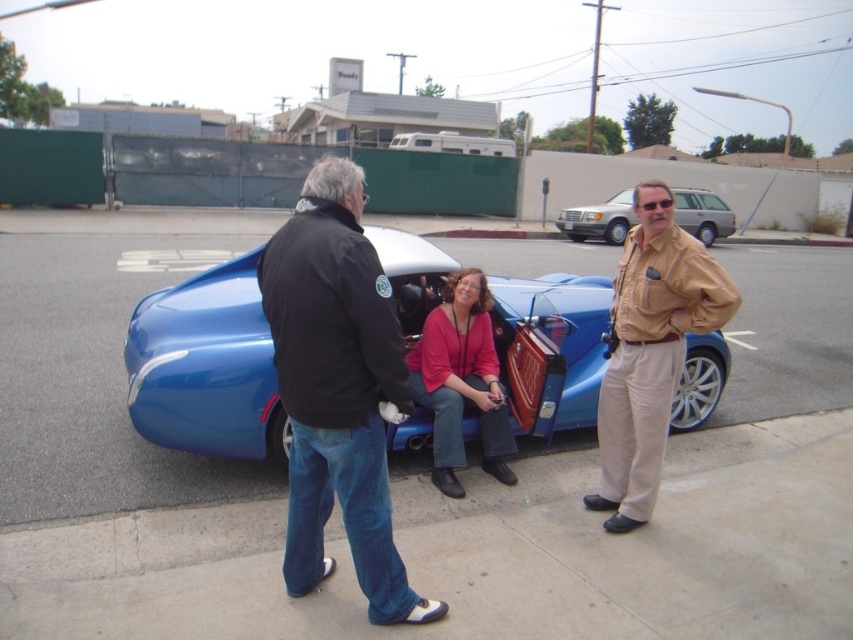
You are a photographer trying to capture a clear shot of the black leather jacket at center and the silver metallic suv at upper right. From your current position, which object will appear closer to the bottom of the photo?

The black leather jacket at center is positioned under the silver metallic suv at upper right, so it will appear closer to the bottom of the photo.

You are standing on the street and want to take a photo of the tan leather jacket at right and the matte pink sweater at center. Which one should you focus on first to ensure both are in clear focus?

Since the tan leather jacket at right is closer to the viewer than the matte pink sweater at center, you should focus on the tan leather jacket at right first to ensure both are in clear focus.